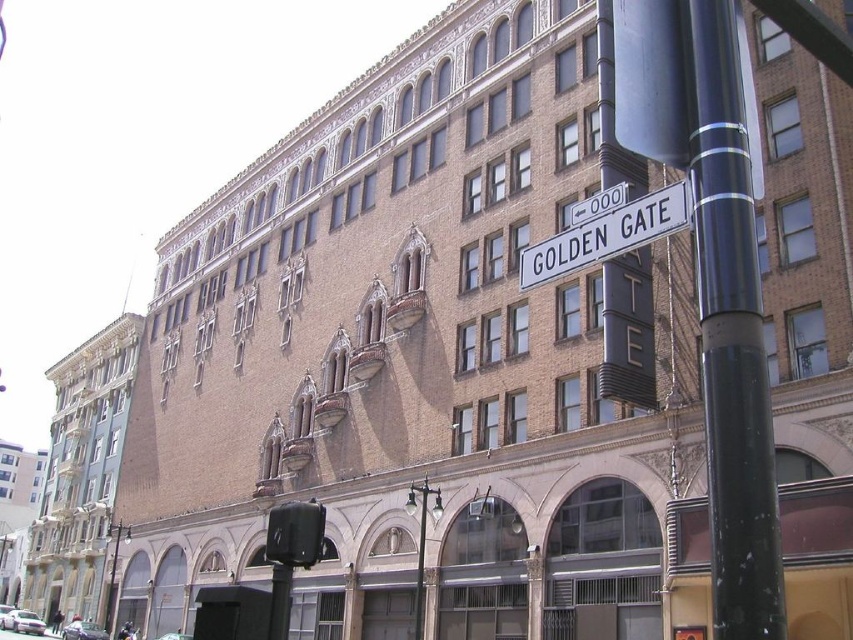
Question: Does black polished pole at right have a larger size compared to metallic silver car at lower left?

Choices:
 (A) yes
 (B) no

Answer: (A)

Question: Which point is farther to the camera?

Choices:
 (A) (4, 627)
 (B) (697, 269)
 (C) (175, 636)
 (D) (524, 257)

Answer: (A)

Question: Which object is the farthest from the white glossy car at lower left?

Choices:
 (A) white plastic street sign at upper center
 (B) silver metallic car at lower left
 (C) black polished pole at right
 (D) metallic silver car at lower left

Answer: (C)

Question: Where is white glossy car at lower left located in relation to metallic silver car at lower left in the image?

Choices:
 (A) left
 (B) right

Answer: (A)

Question: Is white plastic street sign at upper center smaller than metallic silver car at lower left?

Choices:
 (A) no
 (B) yes

Answer: (B)

Question: Which of the following is the closest to the observer?

Choices:
 (A) (16, 627)
 (B) (187, 634)
 (C) (102, 628)
 (D) (596, 236)

Answer: (D)